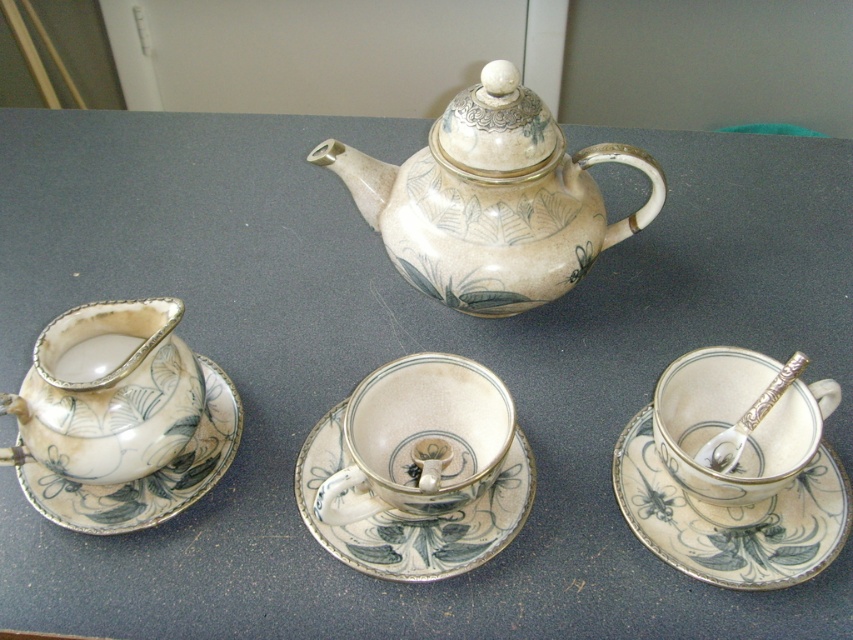
Question: Which point is closer to the camera taking this photo?

Choices:
 (A) (660, 390)
 (B) (193, 461)

Answer: (A)

Question: Among these points, which one is nearest to the camera?

Choices:
 (A) (701, 436)
 (B) (757, 545)
 (C) (445, 465)
 (D) (165, 467)

Answer: (B)

Question: Does matte porcelain teacup at left have a smaller size compared to matte porcelain teacup at center right?

Choices:
 (A) yes
 (B) no

Answer: (A)

Question: Is white glossy teacup at center to the left of matte porcelain teacup at center right from the viewer's perspective?

Choices:
 (A) yes
 (B) no

Answer: (A)

Question: Which object is positioned farthest from the matte ceramic teapot at center?

Choices:
 (A) matte porcelain teacup at center right
 (B) silver metallic spoon at right
 (C) matte porcelain teacup at left
 (D) porcelain saucer at center

Answer: (C)

Question: Is matte ceramic teapot at center to the right of porcelain saucer at left from the viewer's perspective?

Choices:
 (A) yes
 (B) no

Answer: (A)